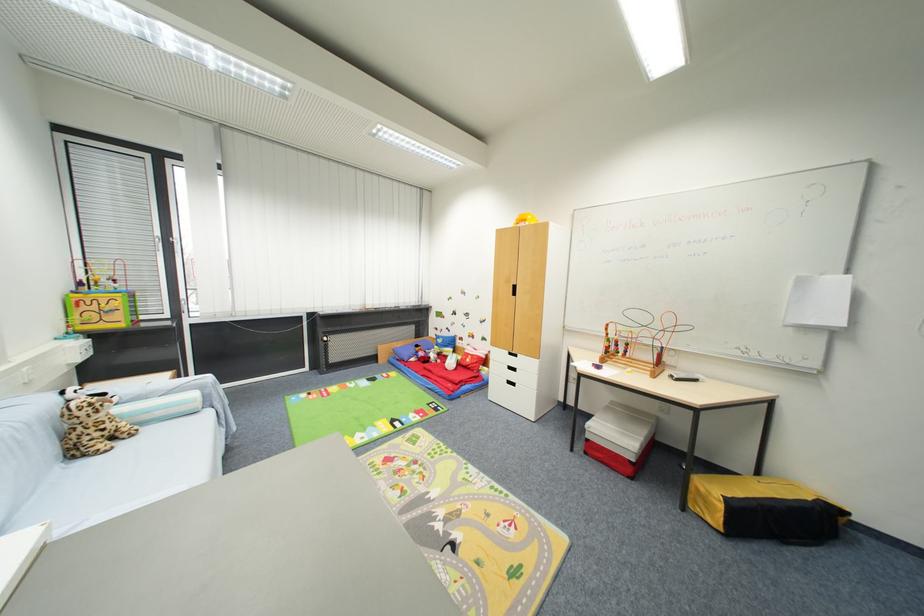
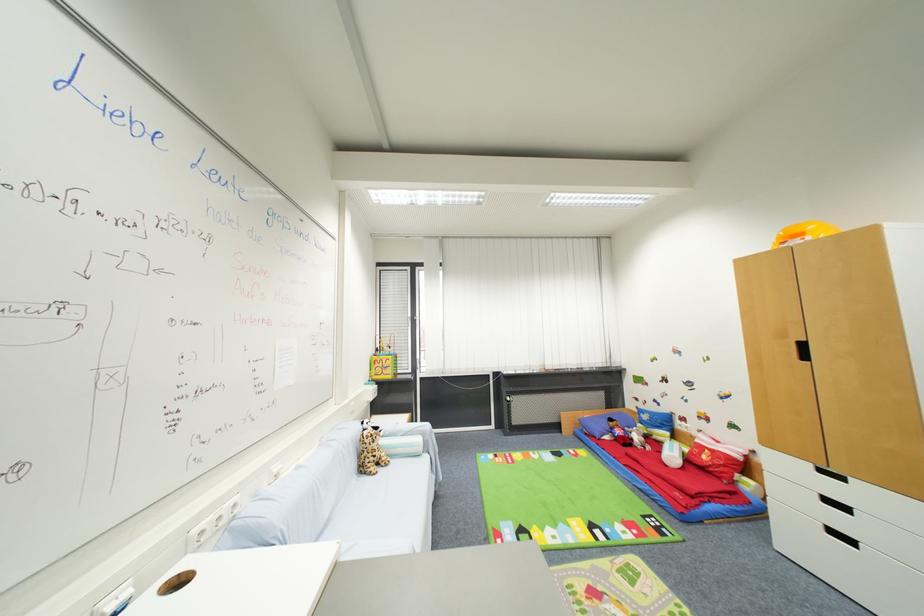
Find the pixel in the second image that matches point (448, 355) in the first image.

(660, 439)